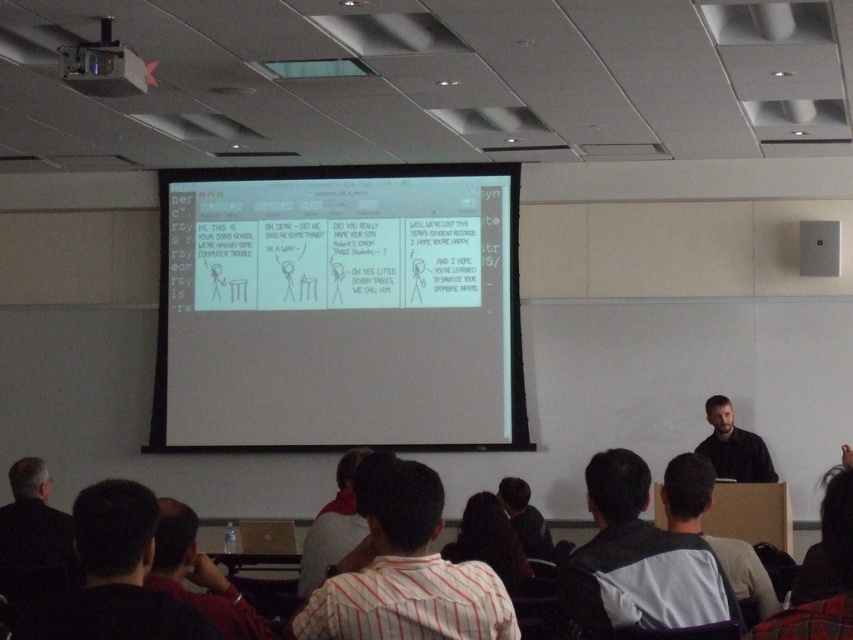
You are a photographer trying to capture a closeup of the presentation slide. You notice two points on the slide marked as point 1 at coordinates (125, 552) and point 2 at coordinates (469, 509). Which point should you focus on to ensure it appears larger in your photo?

Point 1 at coordinates (125, 552) is closer to the camera than point 2 at coordinates (469, 509), so focusing on point 1 will make it appear larger in the photo.

You are a student sitting at point (463, 568). The teacher asks you to walk to the front of the classroom. If your walking speed is 1.2 meters per second, how many seconds will it take you to reach the front?

The distance between point (463, 568) and the camera is 2.42 meters. Since the camera is at the front of the classroom, it will take you approximately 2.42 meters divided by 1.2 meters per second, which equals about 2.02 seconds. So, it will take roughly 2 seconds to reach the front.